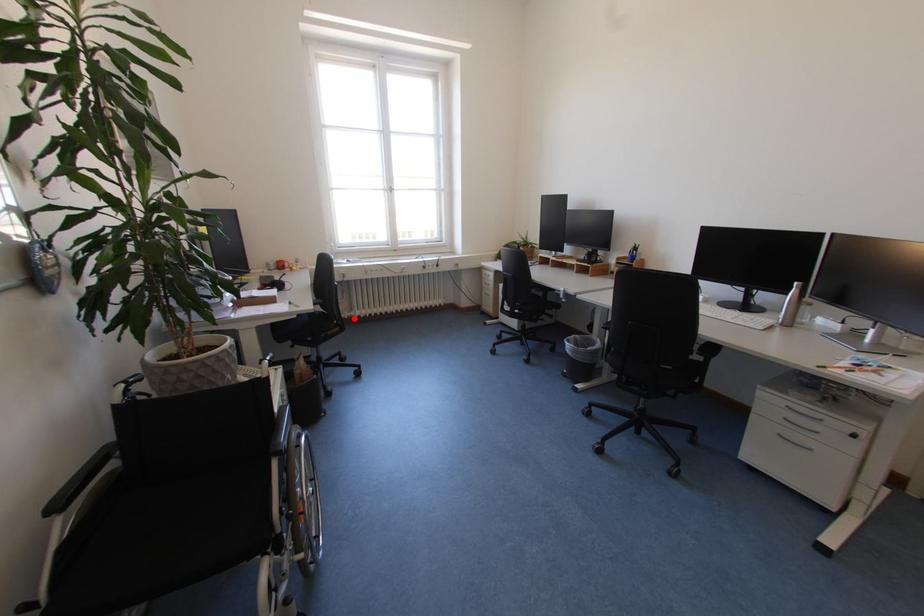
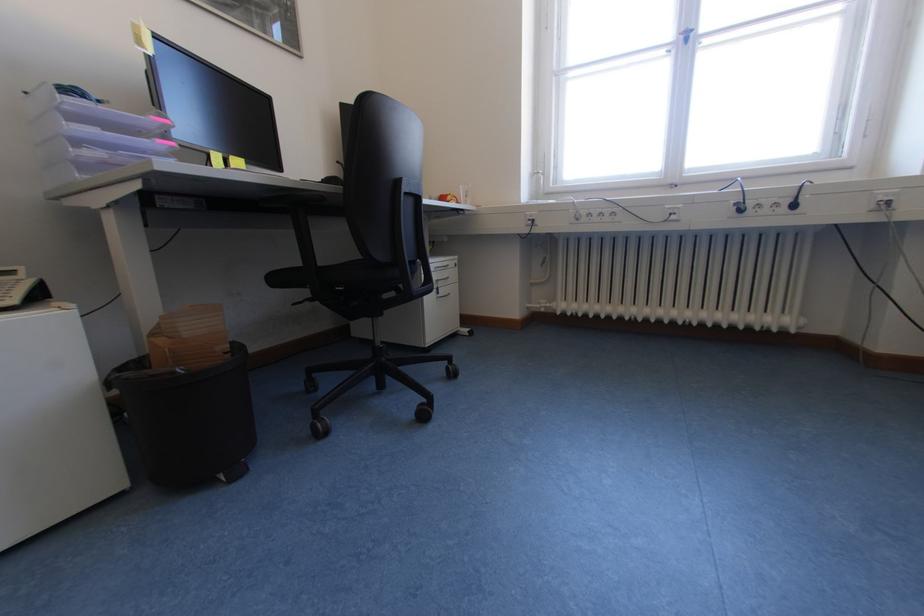
Question: I am providing you with two images of the same scene from different viewpoints. In image1, a red point is highlighted. Considering the same 3D point in image2, which of the following is correct?

Choices:
 (A) It is closer
 (B) It is farther

Answer: (B)